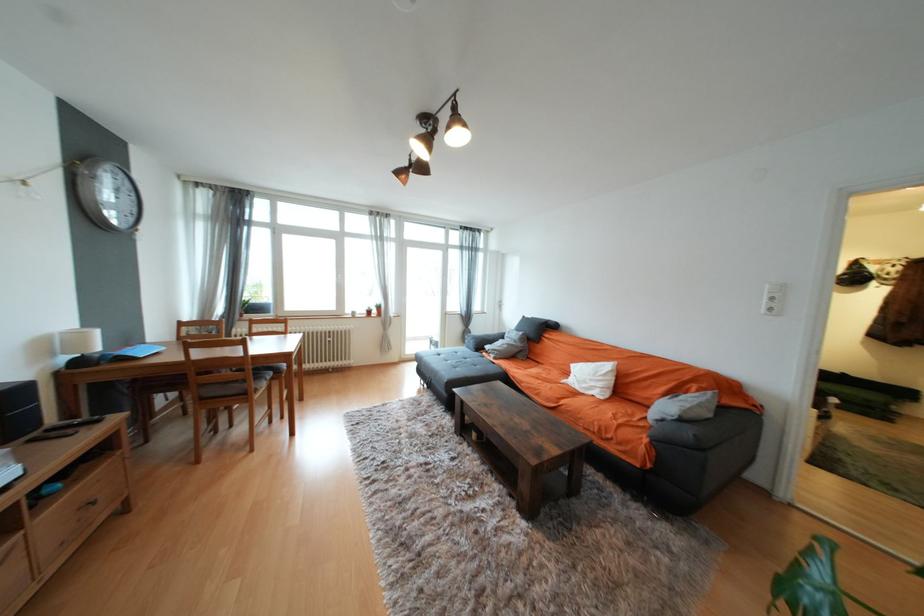
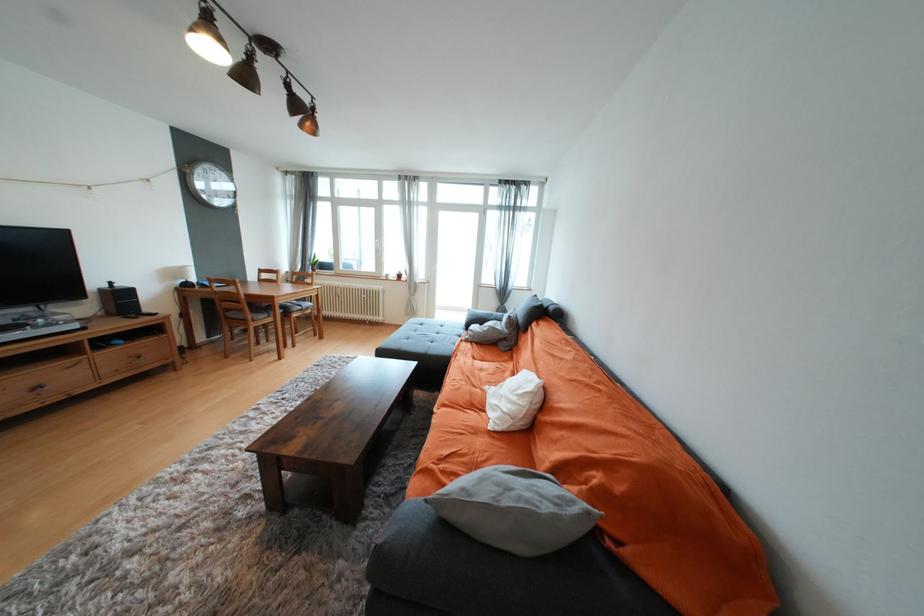
Locate, in the second image, the point that corresponds to pixel 100 504 in the first image.

(146, 358)